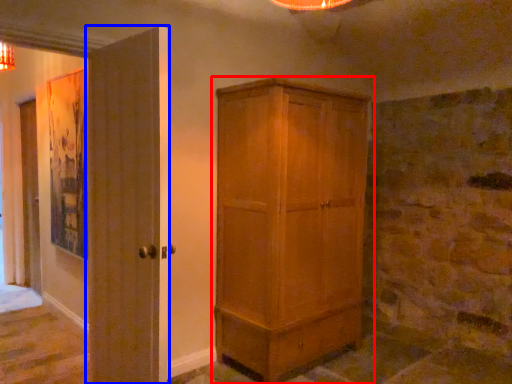
Question: Among these objects, which one is nearest to the camera, cupboard (highlighted by a red box) or door (highlighted by a blue box)?

Choices:
 (A) cupboard
 (B) door

Answer: (B)